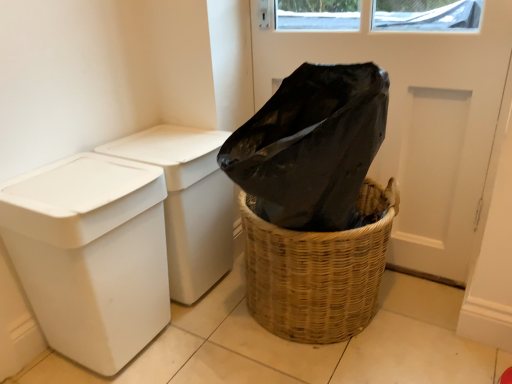
The image size is (512, 384). In order to click on blank space situated above white plastic bin at left, marked as the 1th waste container in a back-to-front arrangement (from a real-world perspective) in this screenshot , I will do `click(167, 142)`.